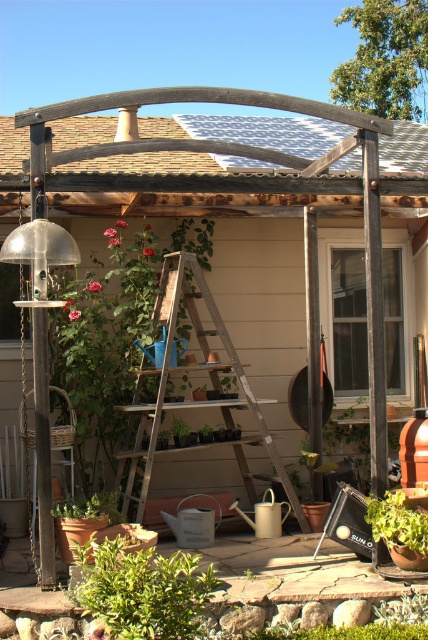
You are a drone operator who needs to fly a drone from the camera position to the metallic tile roof at upper center. What is the approximate distance you need to cover?

The distance between the metallic tile roof at upper center and the camera is 30.23 feet, so the drone needs to cover approximately 30.23 feet to reach the metallic tile roof at upper center.

You are a gardener planning to install a new decorative item in the garden. You have a small statue that takes up the same amount of space as the metallic tile roof at upper center. Will this statue fit in the space currently occupied by the green matte plant at lower left?

The metallic tile roof at upper center occupies less space than the green matte plant at lower left, so the statue, which is the same size as the metallic tile roof at upper center, will fit in the space of the green matte plant at lower left.

You are standing in the garden and want to place a new potted plant between the two points, point (139,604) and point (196,262). Which point should the plant be closer to if you want it to be closer to the front of the garden?

The plant should be placed closer to point (139,604) because it is in front of point (196,262) according to the spatial relationship between the two points.